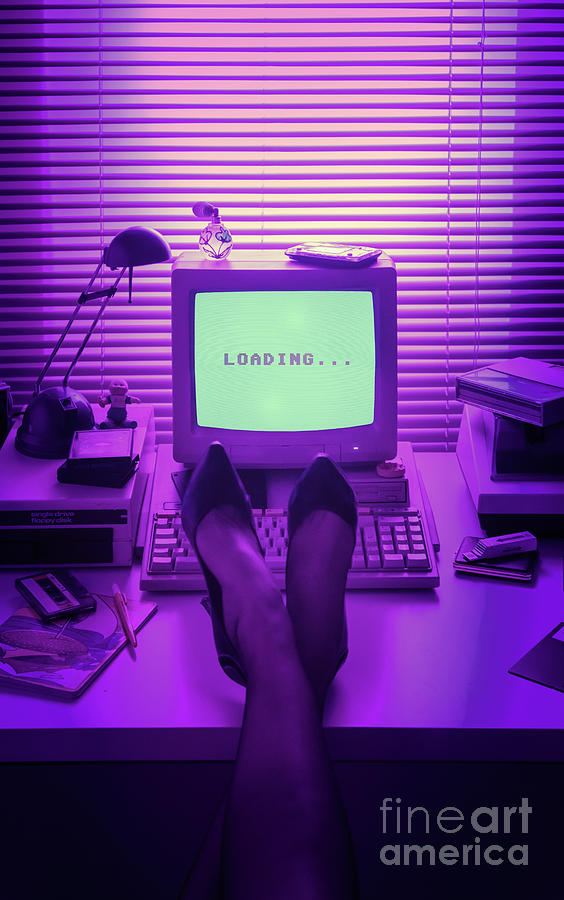
Identify the location of dark purple blinds. This screenshot has height=900, width=564. (78, 18), (541, 120), (547, 284), (30, 239).